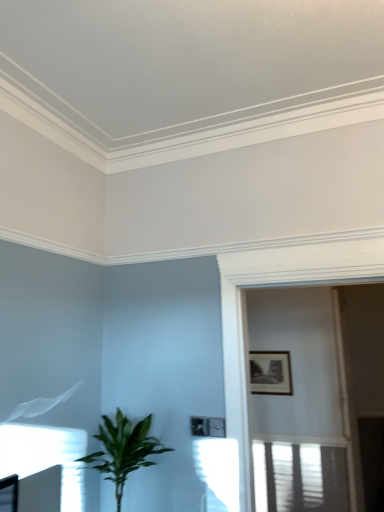
Question: From their relative heights in the image, would you say white glossy screen door at upper center is taller or shorter than black matte picture frame at upper right?

Choices:
 (A) tall
 (B) short

Answer: (A)

Question: Is white glossy screen door at upper center inside or outside of black matte picture frame at upper right?

Choices:
 (A) inside
 (B) outside

Answer: (B)

Question: Which of these objects is positioned farthest from the black matte picture frame at upper right?

Choices:
 (A) white glossy screen door at upper center
 (B) green leafy plant at lower left

Answer: (B)

Question: Which of these objects is positioned closest to the black matte picture frame at upper right?

Choices:
 (A) green leafy plant at lower left
 (B) white glossy screen door at upper center

Answer: (B)